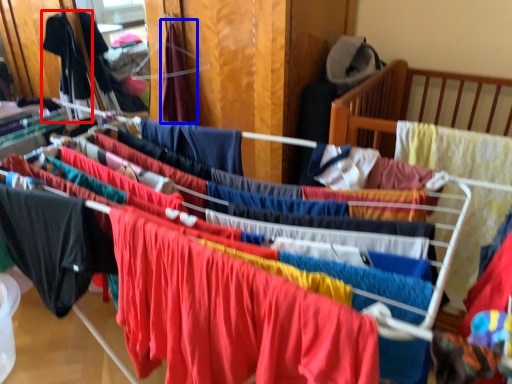
Question: Which of the following is the closest to the observer, clothing (highlighted by a red box) or clothing (highlighted by a blue box)?

Choices:
 (A) clothing
 (B) clothing

Answer: (B)